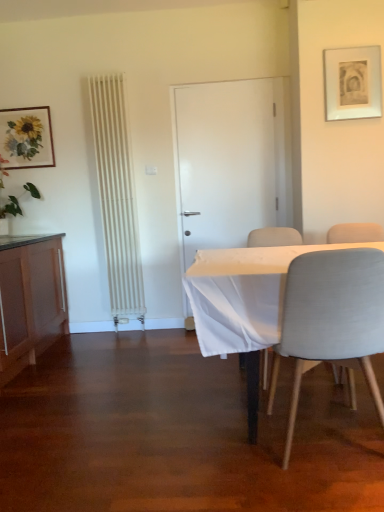
I want to click on free point above white matte door at center (from a real-world perspective), so click(223, 86).